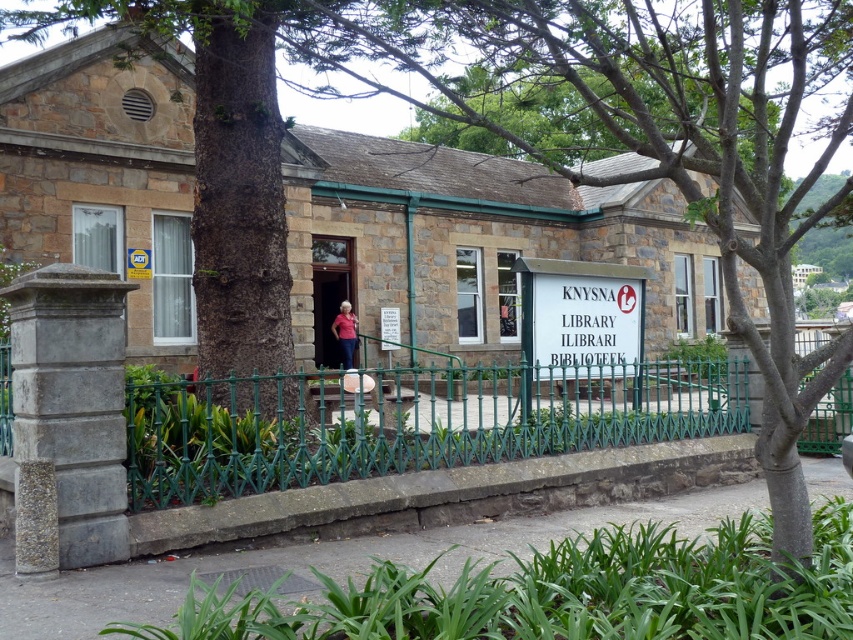
You are standing at the entrance of the KNYSNA LIBRARY. There is a specific point marked at coordinates point (785, 125). If you want to place a small potted plant exactly 3 meters away from this point towards the direction facing away from the library building, where should you place it?

The point (785, 125) is 4.00 meters away from the viewer. To place the potted plant 3 meters away from this point towards the direction facing away from the library, you should position it 1 meter away from your current position towards the same direction.

You are standing at the entrance of the KNYSNA LIBRARY. There is a point marked at coordinates (669, 144). What object is located at that point?

The green leafy tree at center is located at point (669, 144).

Looking at this image, you are standing at the entrance of the KNYSNA LIBRARY and want to locate two specific points marked on the building. The first point is at coordinates point (x=813, y=44) and the second is at point (x=579, y=321). Which of these points is closer to the entrance?

Point (x=813, y=44) is in front of point (x=579, y=321), so it is closer to the entrance.